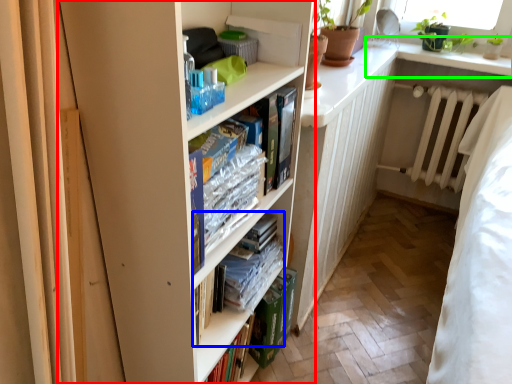
Question: Which is farther away from bookcase (highlighted by a red box)? book (highlighted by a blue box) or window sill (highlighted by a green box)?

Choices:
 (A) book
 (B) window sill

Answer: (B)